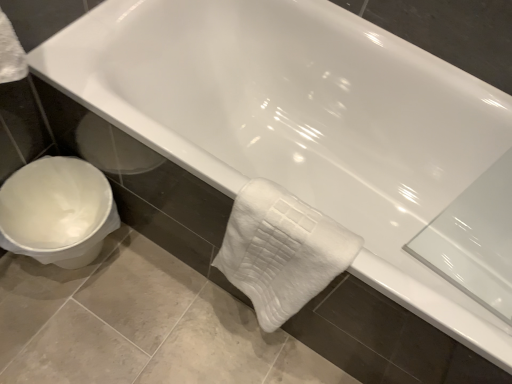
The image size is (512, 384). What do you see at coordinates (57, 211) in the screenshot? I see `white plastic toilet at lower left` at bounding box center [57, 211].

This screenshot has width=512, height=384. Find the location of `white plastic toilet at lower left`. white plastic toilet at lower left is located at coordinates (57, 211).

You are a GUI agent. You are given a task and a screenshot of the screen. Output one action in this format:
    pyautogui.click(x=<x>, y=<y>)
    Task: Click on the white fluffy bath towel at lower center
    
    Given the screenshot: What is the action you would take?
    pyautogui.click(x=281, y=251)

In order to face white fluffy bath towel at lower center, should I rotate leftwards or rightwards?

Turn right by 1.848 degrees to look at white fluffy bath towel at lower center.

The image size is (512, 384). What do you see at coordinates (281, 251) in the screenshot? I see `white fluffy bath towel at lower center` at bounding box center [281, 251].

This screenshot has height=384, width=512. I want to click on white plastic toilet at lower left, so click(x=57, y=211).

Is white fluffy bath towel at lower center at the left side of white plastic toilet at lower left?

No, white fluffy bath towel at lower center is not to the left of white plastic toilet at lower left.

Does white fluffy bath towel at lower center come behind white plastic toilet at lower left?

No, the depth of white fluffy bath towel at lower center is less than that of white plastic toilet at lower left.

Is point (239, 263) closer or farther from the camera than point (85, 227)?

Clearly, point (239, 263) is closer to the camera than point (85, 227).

From the image's perspective, would you say white fluffy bath towel at lower center is shown under white plastic toilet at lower left?

Correct, white fluffy bath towel at lower center appears lower than white plastic toilet at lower left in the image.

From a real-world perspective, is white fluffy bath towel at lower center above or below white plastic toilet at lower left?

In terms of real-world spatial position, white fluffy bath towel at lower center is above white plastic toilet at lower left.

Is white fluffy bath towel at lower center wider or thinner than white plastic toilet at lower left?

Considering their sizes, white fluffy bath towel at lower center looks slimmer than white plastic toilet at lower left.

Is white fluffy bath towel at lower center shorter than white plastic toilet at lower left?

Answer: No, white fluffy bath towel at lower center is not shorter than white plastic toilet at lower left.

Which of these two, white fluffy bath towel at lower center or white plastic toilet at lower left, is smaller?

With smaller size is white fluffy bath towel at lower center.

Would you say white fluffy bath towel at lower center contains white plastic toilet at lower left?

Definitely not — white plastic toilet at lower left is not inside white fluffy bath towel at lower center.

Is white fluffy bath towel at lower center with white plastic toilet at lower left?

No, white fluffy bath towel at lower center is not touching white plastic toilet at lower left.

Is white fluffy bath towel at lower center turned away from white plastic toilet at lower left?

No.

Consider the image. How many degrees apart are the facing directions of white fluffy bath towel at lower center and white plastic toilet at lower left?

The angular difference between white fluffy bath towel at lower center and white plastic toilet at lower left is 91 degrees.

Where is `toilet located on the left of white fluffy bath towel at lower center`? The image size is (512, 384). toilet located on the left of white fluffy bath towel at lower center is located at coordinates (57, 211).

Is white plastic toilet at lower left to the right of white fluffy bath towel at lower center from the viewer's perspective?

No.

Relative to white fluffy bath towel at lower center, is white plastic toilet at lower left in front or behind?

white plastic toilet at lower left is behind white fluffy bath towel at lower center.

Considering the positions of point (7, 206) and point (227, 239), is point (7, 206) closer or farther from the camera than point (227, 239)?

Point (7, 206) is farther from the camera than point (227, 239).

From the image's perspective, would you say white plastic toilet at lower left is positioned over white fluffy bath towel at lower center?

Correct, white plastic toilet at lower left appears higher than white fluffy bath towel at lower center in the image.

From a real-world perspective, is white plastic toilet at lower left positioned over white fluffy bath towel at lower center based on gravity?

No, from a real-world perspective, white plastic toilet at lower left is not on top of white fluffy bath towel at lower center.

Considering the relative sizes of white plastic toilet at lower left and white fluffy bath towel at lower center in the image provided, is white plastic toilet at lower left thinner than white fluffy bath towel at lower center?

No, white plastic toilet at lower left is not thinner than white fluffy bath towel at lower center.

Who is shorter, white plastic toilet at lower left or white fluffy bath towel at lower center?

white plastic toilet at lower left.

Does white plastic toilet at lower left have a larger size compared to white fluffy bath towel at lower center?

Indeed, white plastic toilet at lower left has a larger size compared to white fluffy bath towel at lower center.

Can white fluffy bath towel at lower center be found inside white plastic toilet at lower left?

No, white fluffy bath towel at lower center is located outside of white plastic toilet at lower left.

Are white plastic toilet at lower left and white fluffy bath towel at lower center far apart?

They are positioned close to each other.

Consider the image. Is white plastic toilet at lower left turned away from white fluffy bath towel at lower center?

white plastic toilet at lower left does not have its back to white fluffy bath towel at lower center.

How different are the orientations of white plastic toilet at lower left and white fluffy bath towel at lower center in degrees?

91 degrees.

How distant is white plastic toilet at lower left from white fluffy bath towel at lower center?

white plastic toilet at lower left is 18.73 inches from white fluffy bath towel at lower center.

Find the location of `bath towel below the white plastic toilet at lower left (from the image's perspective)`. bath towel below the white plastic toilet at lower left (from the image's perspective) is located at coordinates (281, 251).

Identify the location of bath towel above the white plastic toilet at lower left (from a real-world perspective). (281, 251).

Where is `toilet that is behind the white fluffy bath towel at lower center`? Image resolution: width=512 pixels, height=384 pixels. toilet that is behind the white fluffy bath towel at lower center is located at coordinates (57, 211).